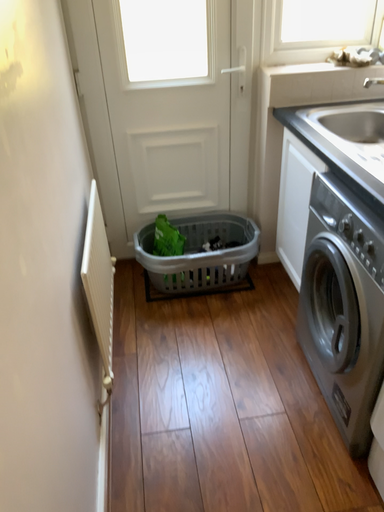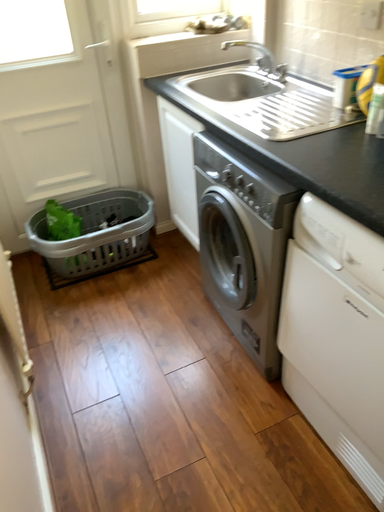
Question: Which way did the camera rotate in the video?

Choices:
 (A) rotated right
 (B) rotated left

Answer: (A)